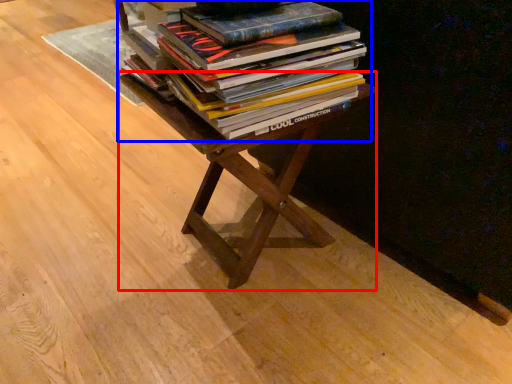
Question: Which object appears farthest to the camera in this image, table (highlighted by a red box) or book (highlighted by a blue box)?

Choices:
 (A) table
 (B) book

Answer: (A)